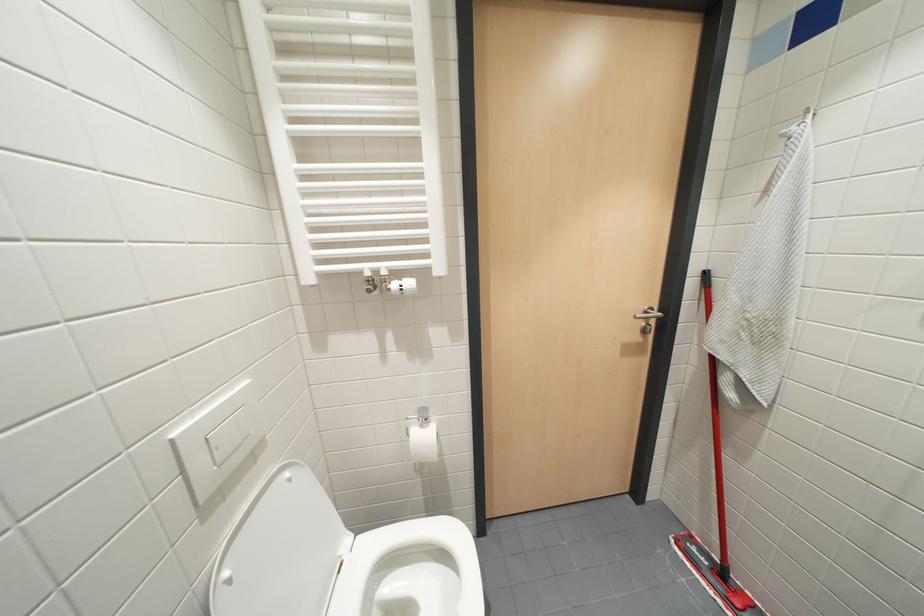
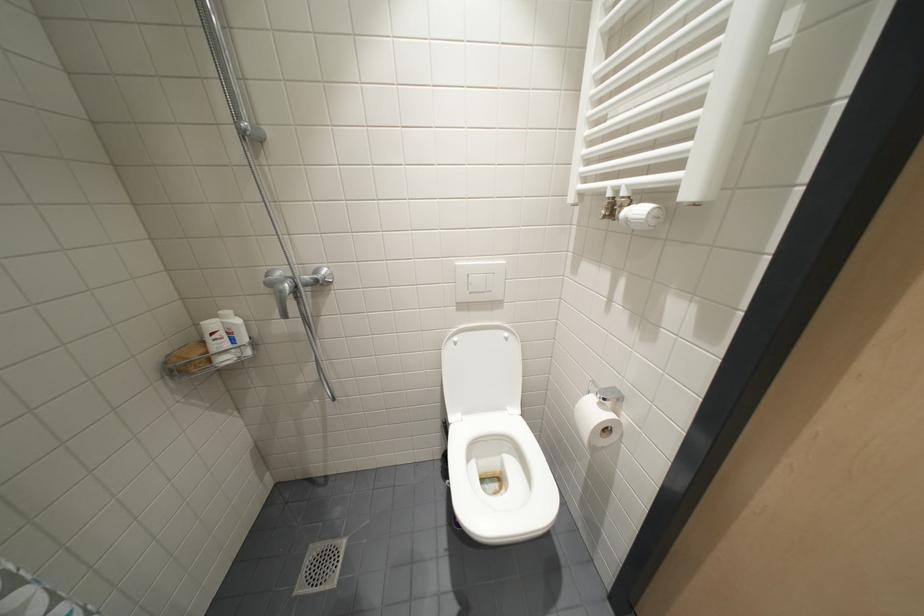
How did the camera likely rotate?

The rotation direction of the camera is left-down.